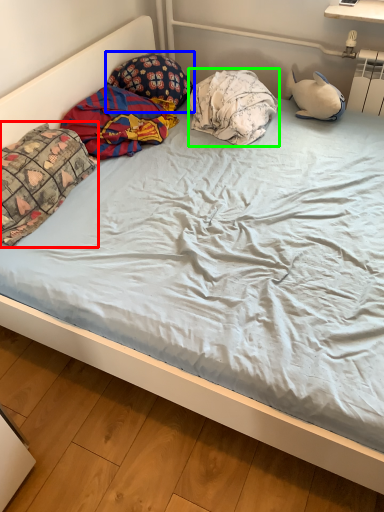
Question: Which object is the closest to the pillow (highlighted by a red box)? Choose among these: pillow (highlighted by a blue box) or pillow (highlighted by a green box).

Choices:
 (A) pillow
 (B) pillow

Answer: (A)